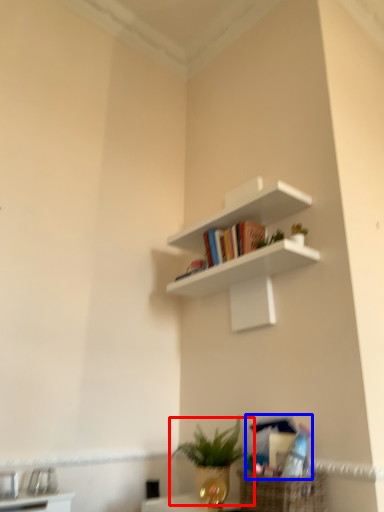
Question: Which of the following is the closest to the observer, houseplant (highlighted by a red box) or book (highlighted by a blue box)?

Choices:
 (A) houseplant
 (B) book

Answer: (B)